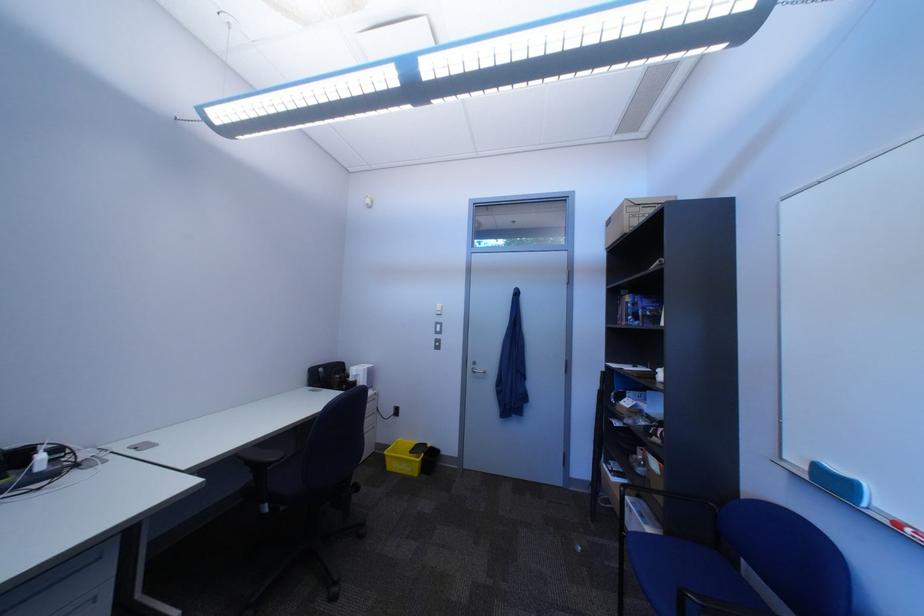
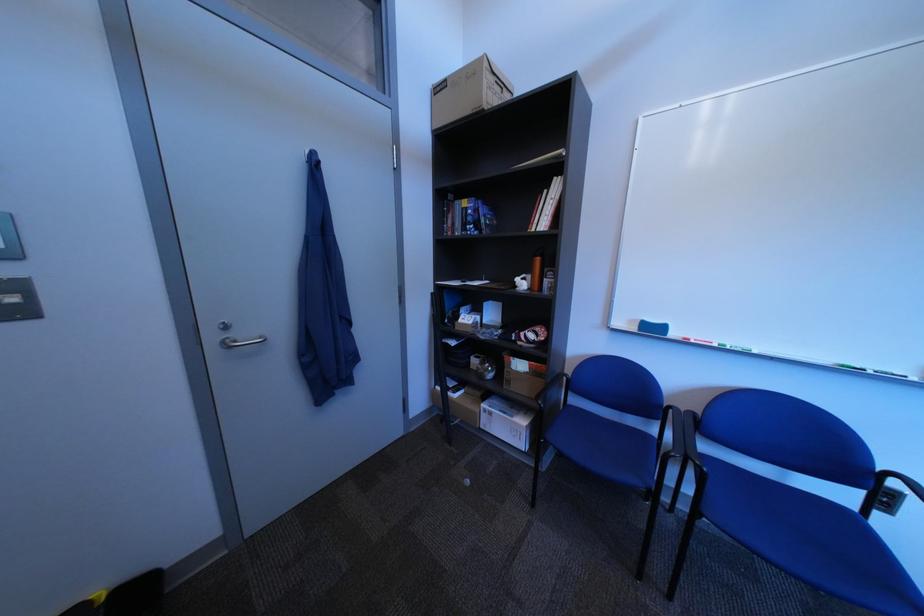
The point at (664, 484) is marked in the first image. Where is the corresponding point in the second image?

(525, 383)